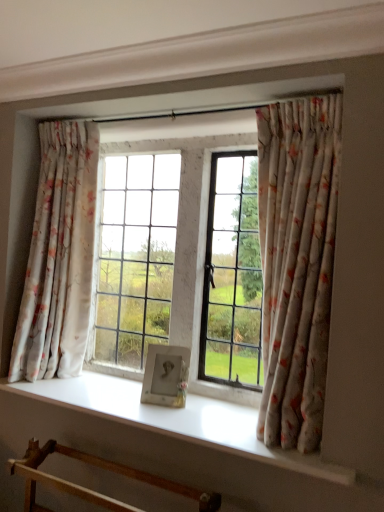
Question: Does floral fabric curtain at right, which ranks as the 2th curtain in left-to-right order, appear on the left side of wooden frame at lower left?

Choices:
 (A) no
 (B) yes

Answer: (A)

Question: Would you say floral fabric curtain at right, which appears as the second curtain when viewed from the back, contains wooden frame at lower left?

Choices:
 (A) yes
 (B) no

Answer: (B)

Question: Does floral fabric curtain at right, which appears as the second curtain when viewed from the back, have a smaller size compared to wooden frame at lower left?

Choices:
 (A) yes
 (B) no

Answer: (B)

Question: Is the position of floral fabric curtain at right, which ranks as the 2th curtain in left-to-right order, more distant than that of wooden frame at lower left?

Choices:
 (A) yes
 (B) no

Answer: (A)

Question: Does floral fabric curtain at right, the first curtain from the front, touch wooden frame at lower left?

Choices:
 (A) no
 (B) yes

Answer: (A)

Question: Is floral fabric curtain at right, which appears as the second curtain when viewed from the back, thinner than wooden frame at lower left?

Choices:
 (A) no
 (B) yes

Answer: (B)

Question: From the image's perspective, is floral fabric curtain at left, which appears as the second curtain when viewed from the right, under floral fabric curtain at right, marked as the first curtain in a right-to-left arrangement?

Choices:
 (A) yes
 (B) no

Answer: (B)

Question: Considering the relative positions of floral fabric curtain at left, arranged as the 2th curtain when viewed from the front, and floral fabric curtain at right, marked as the first curtain in a right-to-left arrangement, in the image provided, is floral fabric curtain at left, arranged as the 2th curtain when viewed from the front, to the left of floral fabric curtain at right, marked as the first curtain in a right-to-left arrangement, from the viewer's perspective?

Choices:
 (A) yes
 (B) no

Answer: (A)

Question: Can you confirm if floral fabric curtain at left, arranged as the 2th curtain when viewed from the front, is taller than floral fabric curtain at right, the first curtain from the front?

Choices:
 (A) no
 (B) yes

Answer: (A)

Question: Considering the relative positions of floral fabric curtain at left, which appears as the second curtain when viewed from the right, and floral fabric curtain at right, the first curtain from the front, in the image provided, is floral fabric curtain at left, which appears as the second curtain when viewed from the right, to the right of floral fabric curtain at right, the first curtain from the front, from the viewer's perspective?

Choices:
 (A) no
 (B) yes

Answer: (A)

Question: Is floral fabric curtain at left, which ranks as the first curtain in back-to-front order, far away from floral fabric curtain at right, which ranks as the 2th curtain in left-to-right order?

Choices:
 (A) no
 (B) yes

Answer: (B)

Question: From a real-world perspective, does floral fabric curtain at left, which appears as the second curtain when viewed from the right, sit lower than floral fabric curtain at right, which ranks as the 2th curtain in left-to-right order?

Choices:
 (A) no
 (B) yes

Answer: (B)

Question: Considering the relative sizes of wooden frame at lower left and floral fabric curtain at left, arranged as the 2th curtain when viewed from the front, in the image provided, is wooden frame at lower left shorter than floral fabric curtain at left, arranged as the 2th curtain when viewed from the front,?

Choices:
 (A) no
 (B) yes

Answer: (B)